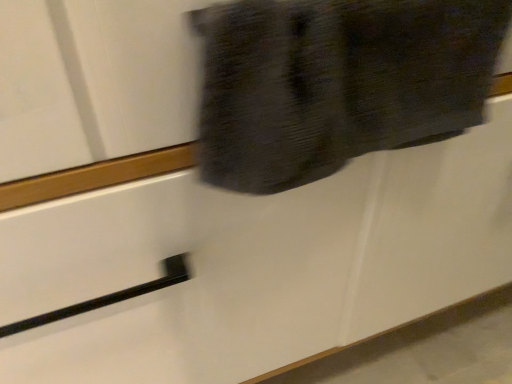
This screenshot has width=512, height=384. What do you see at coordinates (337, 82) in the screenshot?
I see `dark textured towel at upper center` at bounding box center [337, 82].

Measure the distance between dark textured towel at upper center and camera.

dark textured towel at upper center and camera are 10.00 inches apart.

The height and width of the screenshot is (384, 512). Find the location of `dark textured towel at upper center`. dark textured towel at upper center is located at coordinates (337, 82).

I want to click on dark textured towel at upper center, so (x=337, y=82).